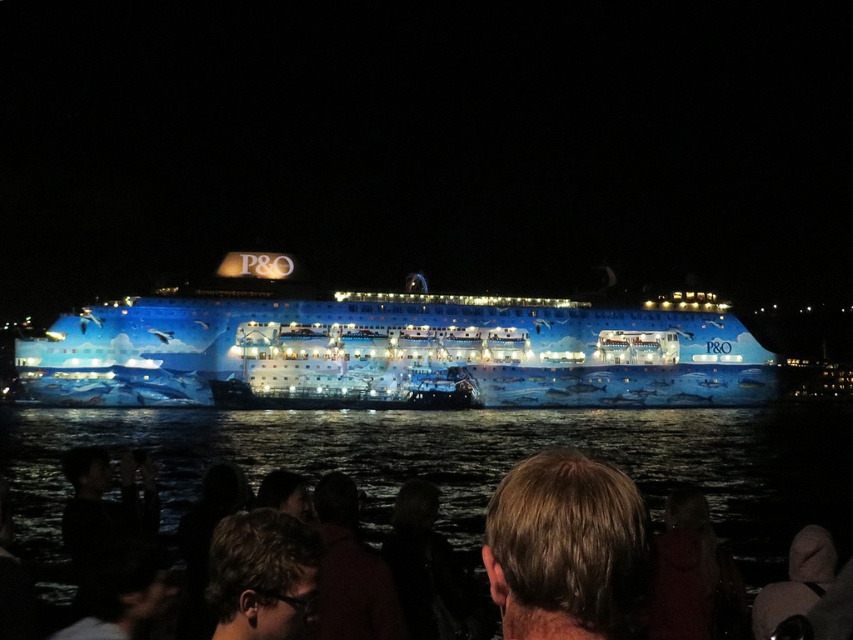
You are standing at the position of the light brown hair at lower center and want to walk to the blonde hair at center. Given that the average walking speed is 3 feet per second, how many seconds will it take you to reach the destination?

The distance between the light brown hair at lower center and blonde hair at center is 53.49 feet. At a speed of 3 feet per second, it would take approximately 17.83 seconds to reach the destination.

You are standing in the crowd facing the cruise ship. You notice two points marked in the scene. The first point is at coordinates point (251, 435) and the second point is at coordinates point (216, 620). Which point is closer to your eyes?

Point (251, 435) is further to the camera than point (216, 620). Therefore, point (216, 620) is closer to your eyes.

You are a photographer trying to capture a group photo of the crowd in front of the P.O cruise ship. You notice two individuals with distinct hair colors and positions. Which person has a wider hair width between the blonde hair at center and the light brown hair at lower center?

The blonde hair at center has a wider width than the light brown hair at lower center.